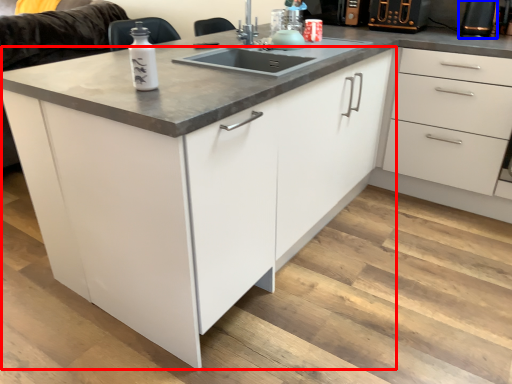
Question: Which of the following is the closest to the observer, cabinetry (highlighted by a red box) or appliance (highlighted by a blue box)?

Choices:
 (A) cabinetry
 (B) appliance

Answer: (A)